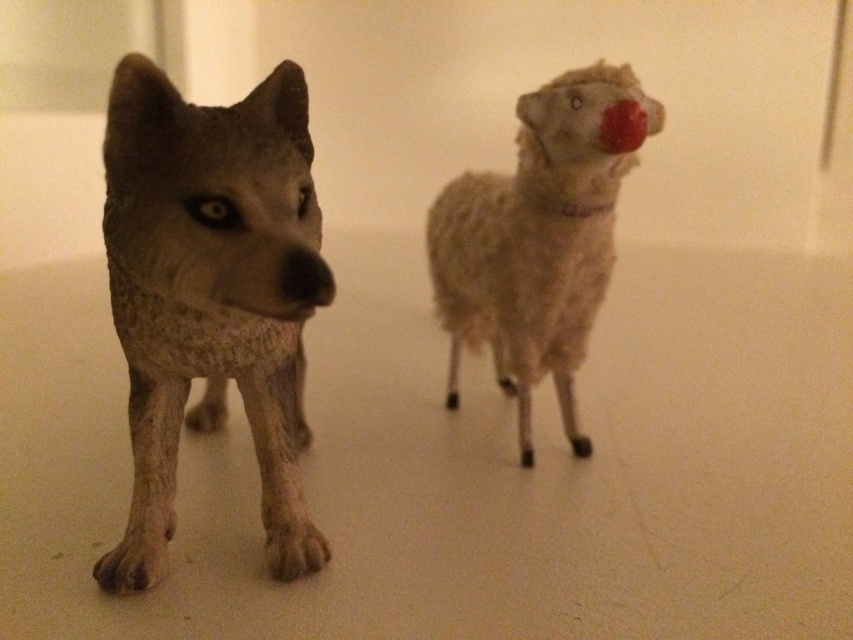
Question: Does gray textured wolf at left have a lesser width compared to fuzzy beige sheep at center?

Choices:
 (A) no
 (B) yes

Answer: (B)

Question: Can you confirm if gray textured wolf at left is smaller than fuzzy beige sheep at center?

Choices:
 (A) yes
 (B) no

Answer: (B)

Question: Is gray textured wolf at left positioned at the back of fuzzy beige sheep at center?

Choices:
 (A) no
 (B) yes

Answer: (A)

Question: Among these objects, which one is farthest from the camera?

Choices:
 (A) gray textured wolf at left
 (B) fuzzy beige sheep at center

Answer: (B)